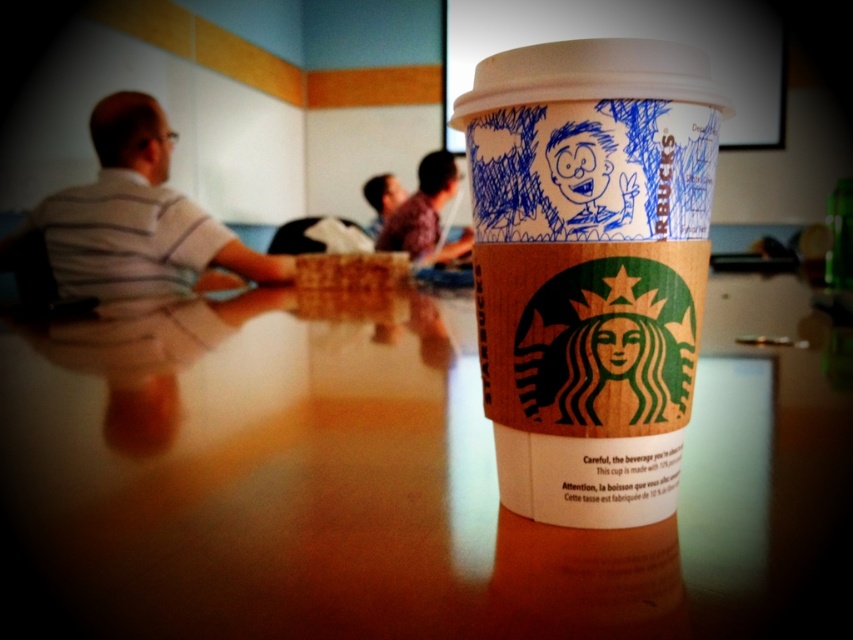
You are at a Starbucks and want to place your phone on the wooden table at center. However, there is a brown paper cup at center in the way. Can you still place your phone on the table without moving the cup?

The wooden table at center is located below the brown paper cup at center, meaning the cup is on the table. Therefore, you can still place your phone on the remaining space of the wooden table at center if there is enough room not occupied by the brown paper cup at center.

You are organizing a clothing rack and need to place the striped shirt at left and the plaid shirt at center. Based on their widths, which one should you place first to maximize space efficiency?

The striped shirt at left is wider than the plaid shirt at center, so you should place the plaid shirt at center first to allow the wider striped shirt at left to fit better afterward.

You are sitting at the wooden table at center and looking at the striped shirt at left. Which object is taller?

The striped shirt at left is taller than the wooden table at center.